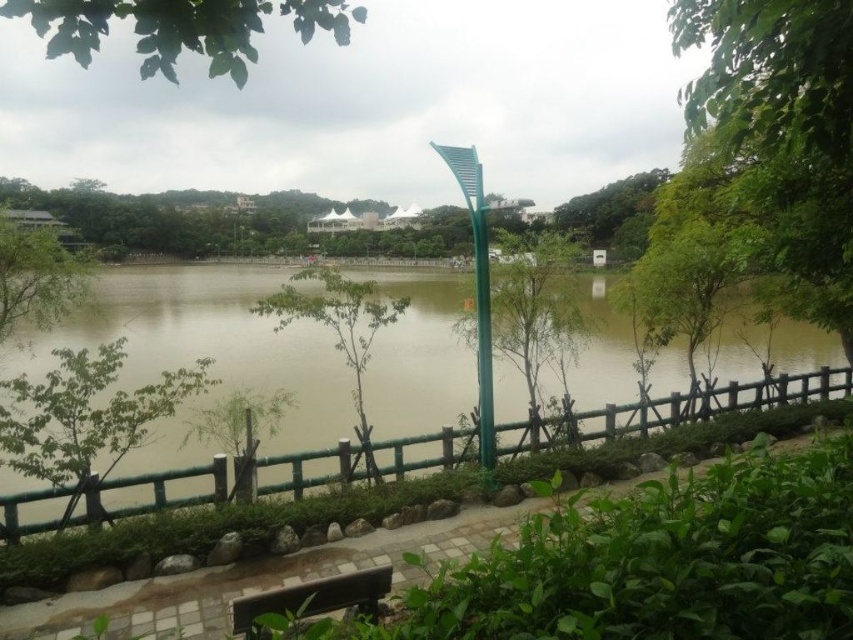
Question: Estimate the real-world distances between objects in this image. Which object is closer to the green leafy tree at lower left?

Choices:
 (A) brown wooden bench at lower center
 (B) green leafy tree at upper right
 (C) green leafy tree at center
 (D) green leafy tree at left

Answer: (D)

Question: Is green leafy tree at lower left above green leafy tree at left?

Choices:
 (A) no
 (B) yes

Answer: (A)

Question: Does green bamboo fence at center have a larger size compared to green leafy tree at upper left?

Choices:
 (A) no
 (B) yes

Answer: (A)

Question: Estimate the real-world distances between objects in this image. Which object is farther from the brown wooden bench at lower center?

Choices:
 (A) green leafy tree at center
 (B) green bamboo fence at center

Answer: (B)

Question: Can you confirm if green leafy tree at center is positioned to the right of brown wooden bench at lower center?

Choices:
 (A) no
 (B) yes

Answer: (A)

Question: Which of the following is the farthest from the observer?

Choices:
 (A) green leafy tree at center
 (B) green leafy tree at left
 (C) brown wooden bench at lower center
 (D) green leafy tree at upper left

Answer: (A)